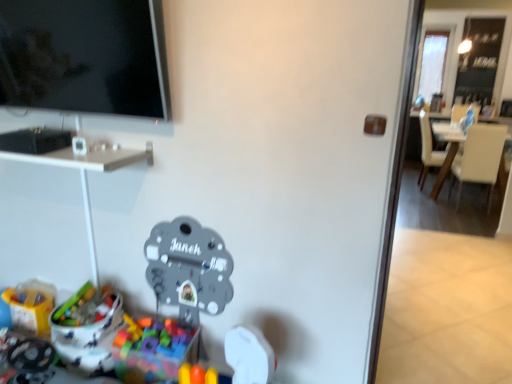
Where is `white leather armchair at upper right`? The height and width of the screenshot is (384, 512). white leather armchair at upper right is located at coordinates (458, 112).

Where is `white leather chair at right, arranged as the 2th chair when viewed from the front`? The height and width of the screenshot is (384, 512). white leather chair at right, arranged as the 2th chair when viewed from the front is located at coordinates (426, 148).

Image resolution: width=512 pixels, height=384 pixels. What do you see at coordinates (87, 158) in the screenshot?
I see `white glossy desk at upper left` at bounding box center [87, 158].

What do you see at coordinates (31, 305) in the screenshot? This screenshot has width=512, height=384. I see `plastic toy at lower left, the 3th toy when ordered from right to left` at bounding box center [31, 305].

What do you see at coordinates (153, 350) in the screenshot? I see `multicolored plastic blocks at lower left, which ranks as the second toy in right-to-left order` at bounding box center [153, 350].

What do you see at coordinates (447, 152) in the screenshot? I see `white leather chair at right, the 2th chair positioned from the back` at bounding box center [447, 152].

You are a GUI agent. You are given a task and a screenshot of the screen. Output one action in this format:
    pyautogui.click(x=<x>, y=<y>)
    Task: Click on the white leather armchair at upper right
    The image size is (512, 384).
    Given the screenshot: What is the action you would take?
    pyautogui.click(x=458, y=112)

Can we say plastic toy at lower left, the 3th toy when ordered from right to left, lies outside white leather armchair at upper right?

Indeed, plastic toy at lower left, the 3th toy when ordered from right to left, is completely outside white leather armchair at upper right.

From the image's perspective, which toy is the 2nd one below the white leather armchair at upper right? Please provide its 2D coordinates.

[(31, 305)]

Which object is positioned more to the left, plastic toy at lower left, the first toy positioned from the left, or white leather armchair at upper right?

plastic toy at lower left, the first toy positioned from the left.

Who is taller, plastic toy at lower left, the first toy positioned from the left, or white leather chair at right, which is the first chair in front-to-back order?

With more height is white leather chair at right, which is the first chair in front-to-back order.

Is point (28, 285) farther from viewer compared to point (502, 173)?

No, it is in front of (502, 173).

Is the position of plastic toy at lower left, the 3th toy when ordered from right to left, less distant than that of white leather chair at right, which is the first chair in front-to-back order?

Yes.

Is plastic toy at lower left, the 3th toy when ordered from right to left, looking in the opposite direction of white leather chair at right, which is the first chair in front-to-back order?

plastic toy at lower left, the 3th toy when ordered from right to left, is not turned away from white leather chair at right, which is the first chair in front-to-back order.

Can you confirm if multicolored plastic blocks at lower left, which ranks as the second toy in right-to-left order, is thinner than metallic gray clock at center, the third toy positioned from the left?

Incorrect, the width of multicolored plastic blocks at lower left, which ranks as the second toy in right-to-left order, is not less than that of metallic gray clock at center, the third toy positioned from the left.

Consider the image. Which of these two, multicolored plastic blocks at lower left, which ranks as the second toy in right-to-left order, or metallic gray clock at center, which appears as the first toy when viewed from the right, is bigger?

multicolored plastic blocks at lower left, which ranks as the second toy in right-to-left order.

Based on the photo, considering the sizes of objects multicolored plastic blocks at lower left, arranged as the 2th toy when viewed from the left, and metallic gray clock at center, which appears as the first toy when viewed from the right, in the image provided, who is taller, multicolored plastic blocks at lower left, arranged as the 2th toy when viewed from the left, or metallic gray clock at center, which appears as the first toy when viewed from the right,?

metallic gray clock at center, which appears as the first toy when viewed from the right.

Choose the correct answer: Is multicolored plastic blocks at lower left, arranged as the 2th toy when viewed from the left, inside metallic gray clock at center, the third toy positioned from the left, or outside it?

multicolored plastic blocks at lower left, arranged as the 2th toy when viewed from the left, is spatially situated outside metallic gray clock at center, the third toy positioned from the left.

Is white glossy desk at upper left bigger or smaller than plastic toy at lower left, the first toy positioned from the left?

Clearly, white glossy desk at upper left is larger in size than plastic toy at lower left, the first toy positioned from the left.

Between white glossy desk at upper left and plastic toy at lower left, the 3th toy when ordered from right to left, which one is positioned behind?

plastic toy at lower left, the 3th toy when ordered from right to left, is further from the camera.

Is point (104, 161) closer to camera compared to point (30, 302)?

Yes, point (104, 161) is closer to viewer.

Is point (194, 255) closer or farther from the camera than point (454, 142)?

Point (194, 255) is positioned closer to the camera compared to point (454, 142).

Is white leather chair at right, which is the first chair in front-to-back order, at the back of metallic gray clock at center, which appears as the first toy when viewed from the right?

That's not correct — metallic gray clock at center, which appears as the first toy when viewed from the right, is not looking away from white leather chair at right, which is the first chair in front-to-back order.

Relative to white leather chair at right, the 2th chair positioned from the back, is metallic gray clock at center, the third toy positioned from the left, in front or behind?

metallic gray clock at center, the third toy positioned from the left, is in front of white leather chair at right, the 2th chair positioned from the back.

From the picture: From the image's perspective, which object appears higher, multicolored plastic blocks at lower left, which ranks as the second toy in right-to-left order, or white leather armchair at upper right?

From the image's view, white leather armchair at upper right is above.

Which object is closer to the camera taking this photo, multicolored plastic blocks at lower left, arranged as the 2th toy when viewed from the left, or white leather armchair at upper right?

multicolored plastic blocks at lower left, arranged as the 2th toy when viewed from the left.

Measure the distance between multicolored plastic blocks at lower left, arranged as the 2th toy when viewed from the left, and white leather armchair at upper right.

multicolored plastic blocks at lower left, arranged as the 2th toy when viewed from the left, and white leather armchair at upper right are 4.63 meters apart.

Which of these two, multicolored plastic blocks at lower left, arranged as the 2th toy when viewed from the left, or white leather armchair at upper right, is wider?

Wider between the two is white leather armchair at upper right.

From a real-world perspective, is multicolored plastic blocks at lower left, arranged as the 2th toy when viewed from the left, positioned above or below white leather chair at right, arranged as the 2th chair when viewed from the front?

multicolored plastic blocks at lower left, arranged as the 2th toy when viewed from the left, is below white leather chair at right, arranged as the 2th chair when viewed from the front.

Where is `the 2nd chair above the multicolored plastic blocks at lower left, arranged as the 2th toy when viewed from the left (from the image's perspective)`? The image size is (512, 384). the 2nd chair above the multicolored plastic blocks at lower left, arranged as the 2th toy when viewed from the left (from the image's perspective) is located at coordinates (426, 148).

Is multicolored plastic blocks at lower left, arranged as the 2th toy when viewed from the left, positioned beyond the bounds of white leather chair at right, arranged as the 2th chair when viewed from the front?

Yes.

Considering the relative sizes of multicolored plastic blocks at lower left, arranged as the 2th toy when viewed from the left, and white leather chair at right, positioned as the first chair in back-to-front order, in the image provided, is multicolored plastic blocks at lower left, arranged as the 2th toy when viewed from the left, bigger than white leather chair at right, positioned as the first chair in back-to-front order,?

Actually, multicolored plastic blocks at lower left, arranged as the 2th toy when viewed from the left, might be smaller than white leather chair at right, positioned as the first chair in back-to-front order.

Find the location of a particular element. This screenshot has height=384, width=512. armchair to the right of plastic toy at lower left, the first toy positioned from the left is located at coordinates (458, 112).

At what (x,y) coordinates should I click in order to perform the action: click on the 1st toy in front when counting from the white leather chair at right, which is the first chair in front-to-back order. Please return your answer as a coordinate pair (x, y). The height and width of the screenshot is (384, 512). Looking at the image, I should click on (31, 305).

From the image, which object appears to be nearer to white leather chair at right, positioned as the first chair in back-to-front order, metallic gray clock at center, which appears as the first toy when viewed from the right, or white leather chair at right, which is the first chair in front-to-back order?

Among the two, white leather chair at right, which is the first chair in front-to-back order, is located nearer to white leather chair at right, positioned as the first chair in back-to-front order.

From the image, which object appears to be nearer to white leather chair at right, positioned as the first chair in back-to-front order, plastic toy at lower left, the first toy positioned from the left, or white leather armchair at upper right?

Among the two, white leather armchair at upper right is located nearer to white leather chair at right, positioned as the first chair in back-to-front order.

Looking at the image, which one is located closer to white leather armchair at upper right, white leather chair at right, the 2th chair positioned from the back, or white glossy desk at upper left?

white leather chair at right, the 2th chair positioned from the back, is closer to white leather armchair at upper right.

When comparing their distances from multicolored plastic blocks at lower left, which ranks as the second toy in right-to-left order, does metallic gray clock at center, which appears as the first toy when viewed from the right, or white leather armchair at upper right seem closer?

The object closer to multicolored plastic blocks at lower left, which ranks as the second toy in right-to-left order, is metallic gray clock at center, which appears as the first toy when viewed from the right.

Looking at this image, considering their positions, is multicolored plastic blocks at lower left, arranged as the 2th toy when viewed from the left, positioned closer to metallic gray clock at center, which appears as the first toy when viewed from the right, than white leather chair at right, positioned as the first chair in back-to-front order?

Among the two, multicolored plastic blocks at lower left, arranged as the 2th toy when viewed from the left, is located nearer to metallic gray clock at center, which appears as the first toy when viewed from the right.

Based on their spatial positions, is white leather armchair at upper right or white leather chair at right, which is the first chair in front-to-back order, closer to white glossy desk at upper left?

The object closer to white glossy desk at upper left is white leather chair at right, which is the first chair in front-to-back order.

Estimate the real-world distances between objects in this image. Which object is further from plastic toy at lower left, the 3th toy when ordered from right to left, white leather chair at right, which is the first chair in front-to-back order, or metallic gray clock at center, which appears as the first toy when viewed from the right?

Based on the image, white leather chair at right, which is the first chair in front-to-back order, appears to be further to plastic toy at lower left, the 3th toy when ordered from right to left.

Estimate the real-world distances between objects in this image. Which object is further from white leather armchair at upper right, white glossy desk at upper left or plastic toy at lower left, the 3th toy when ordered from right to left?

Based on the image, plastic toy at lower left, the 3th toy when ordered from right to left, appears to be further to white leather armchair at upper right.

Image resolution: width=512 pixels, height=384 pixels. Identify the location of desk located between plastic toy at lower left, the first toy positioned from the left, and metallic gray clock at center, the third toy positioned from the left, in the left-right direction. (87, 158).

Locate an element on the screen. desk between plastic toy at lower left, the first toy positioned from the left, and white leather armchair at upper right is located at coordinates (87, 158).

At what (x,y) coordinates should I click in order to perform the action: click on toy between plastic toy at lower left, the 3th toy when ordered from right to left, and metallic gray clock at center, the third toy positioned from the left, in the horizontal direction. Please return your answer as a coordinate pair (x, y). Looking at the image, I should click on (153, 350).

I want to click on desk located between plastic toy at lower left, the first toy positioned from the left, and white leather chair at right, which is the first chair in front-to-back order, in the left-right direction, so click(x=87, y=158).